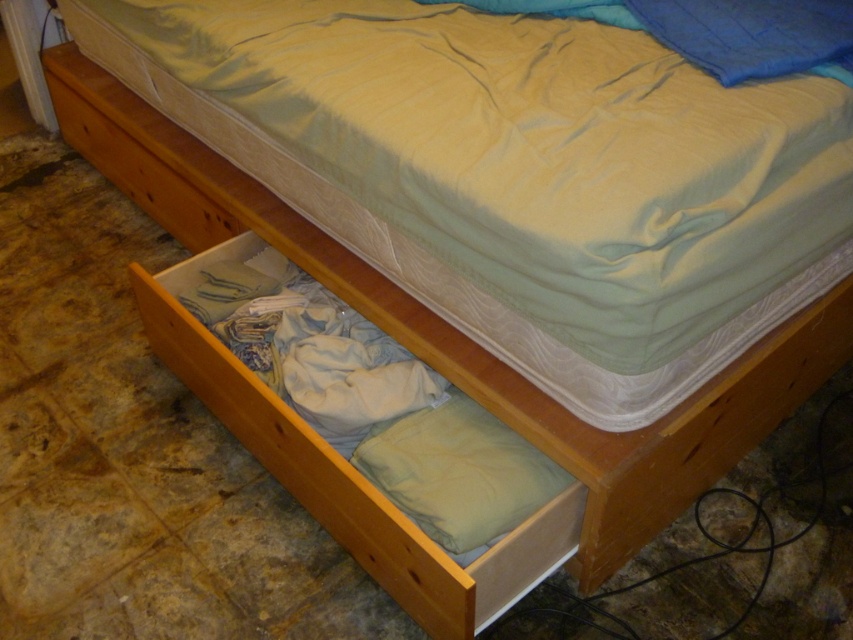
Question: Can you confirm if soft green fabric mattress at center is positioned to the left of light brown wood drawer at lower center?

Choices:
 (A) yes
 (B) no

Answer: (B)

Question: Which point appears closest to the camera in this image?

Choices:
 (A) (167, 168)
 (B) (482, 429)
 (C) (622, 112)

Answer: (C)

Question: Estimate the real-world distances between objects in this image. Which object is closer to the light brown wood drawer at lower left?

Choices:
 (A) light brown wood drawer at lower center
 (B) soft green fabric mattress at center

Answer: (B)

Question: Is soft green fabric mattress at center bigger than light brown wood drawer at lower left?

Choices:
 (A) no
 (B) yes

Answer: (B)

Question: Can you confirm if light brown wood drawer at lower left is positioned above green soft pillow at center?

Choices:
 (A) no
 (B) yes

Answer: (B)

Question: Among these points, which one is farthest from the camera?

Choices:
 (A) (514, 550)
 (B) (430, 467)
 (C) (450, 180)
 (D) (144, 205)

Answer: (D)